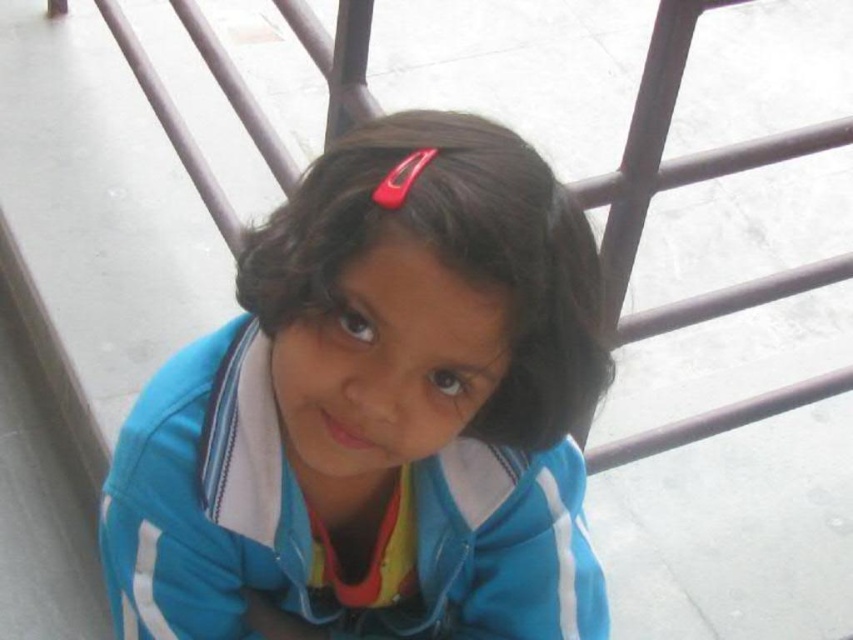
Question: Among these points, which one is farthest from the camera?

Choices:
 (A) (296, 193)
 (B) (390, 424)

Answer: (A)

Question: Considering the relative positions of blue fabric jacket at center and dark brown silky hair at center in the image provided, where is blue fabric jacket at center located with respect to dark brown silky hair at center?

Choices:
 (A) right
 (B) left

Answer: (B)

Question: Which point is closer to the camera?

Choices:
 (A) dark brown silky hair at center
 (B) blue fabric jacket at center

Answer: (A)

Question: Does blue fabric jacket at center have a smaller size compared to dark brown silky hair at center?

Choices:
 (A) no
 (B) yes

Answer: (A)

Question: Can you confirm if blue fabric jacket at center is wider than dark brown silky hair at center?

Choices:
 (A) no
 (B) yes

Answer: (B)